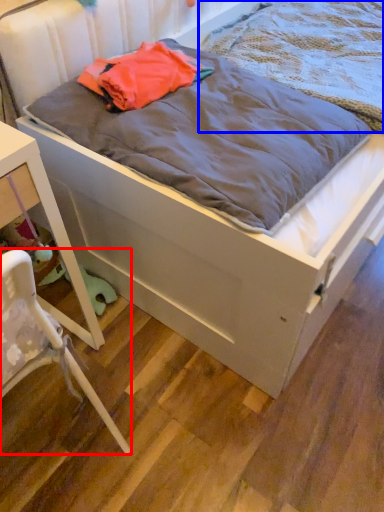
Question: Which of the following is the closest to the observer, chair (highlighted by a red box) or blanket (highlighted by a blue box)?

Choices:
 (A) chair
 (B) blanket

Answer: (A)